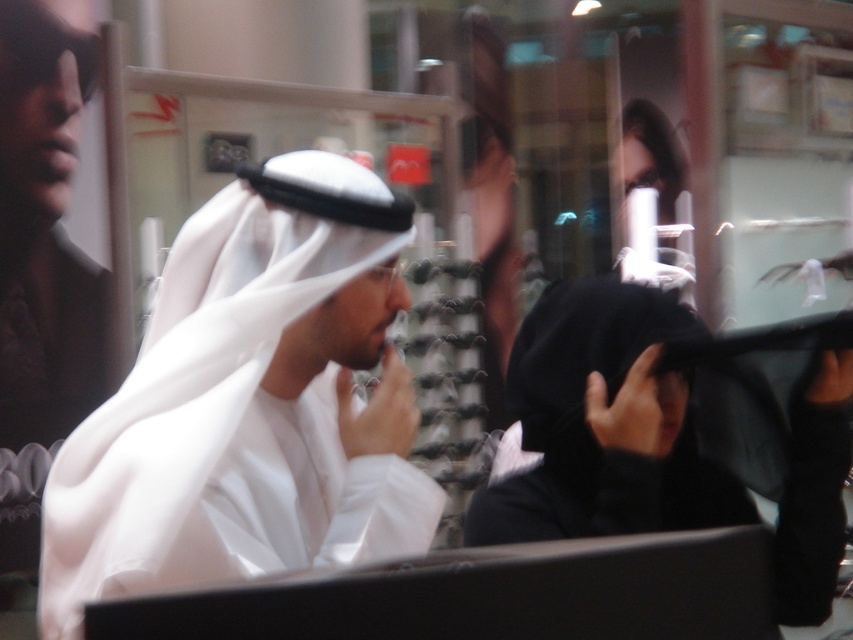
Question: Does white matte headscarf at center appear over black matte niqab at center?

Choices:
 (A) yes
 (B) no

Answer: (A)

Question: Which point is farther from the camera taking this photo?

Choices:
 (A) (45, 625)
 (B) (831, 353)

Answer: (B)

Question: Is white matte headscarf at center in front of black matte niqab at center?

Choices:
 (A) no
 (B) yes

Answer: (B)

Question: Which of the following is the farthest from the observer?

Choices:
 (A) white matte headscarf at center
 (B) black matte niqab at center

Answer: (B)

Question: Which object appears farthest from the camera in this image?

Choices:
 (A) black matte niqab at center
 (B) white matte headscarf at center

Answer: (A)

Question: Does white matte headscarf at center come in front of black matte niqab at center?

Choices:
 (A) yes
 (B) no

Answer: (A)